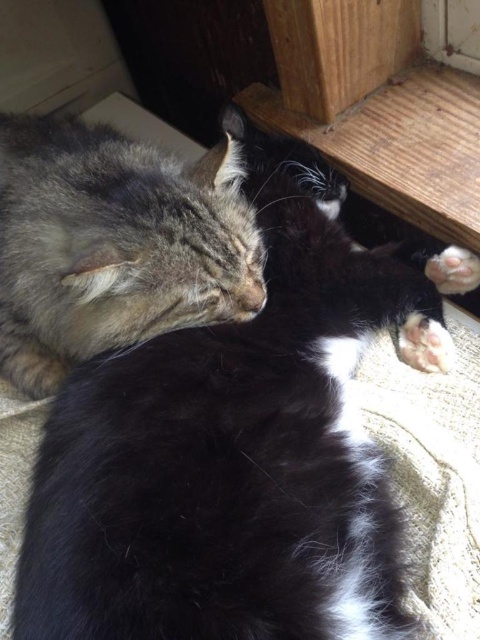
You are looking at the image and want to locate the gray fur cat at upper left. What are the coordinates of its position?

The gray fur cat at upper left is located at coordinates (113, 244).

In the scene shown: You are a pet owner who wants to ensure both cats are comfortable. Given the distance between the gray fur cat at upper left and the white soft fur paw at lower right, can you determine if they are close enough to touch each other?

The gray fur cat at upper left and the white soft fur paw at lower right are 27.05 inches apart, so they are too far to touch each other.

You are a photographer trying to capture both the gray fur cat at upper left and the white soft paw at lower right in the same frame. Based on their sizes, which one should you focus on to ensure both fit comfortably in the photo?

The gray fur cat at upper left is larger than the white soft paw at lower right, so you should focus on capturing the gray fur cat at upper left first to ensure both fit comfortably in the photo.